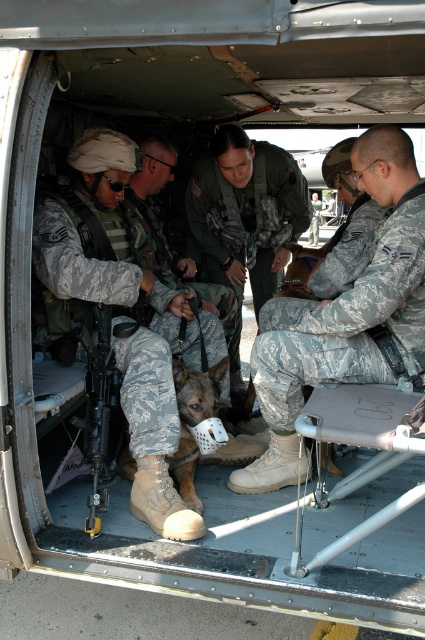
You are a military medic inside the helicopter and need to quickly identify the position of the camouflage fabric uniform at center and camouflage fabric dog at center. From your perspective, which object is located to the left?

The camouflage fabric dog at center is to the left of the camouflage fabric uniform at center, so the camouflage fabric dog at center is located to the left.

You are a military medic in the helicopter. You need to reach the medical kit located between the camouflage fabric uniform at center and the dark brown fur at center. Can you fit through the space between them?

The camouflage fabric uniform at center and dark brown fur at center are 34.56 inches apart. Since the average medical kit is about 12 inches wide, there is enough space for the medic to fit through the gap between them.